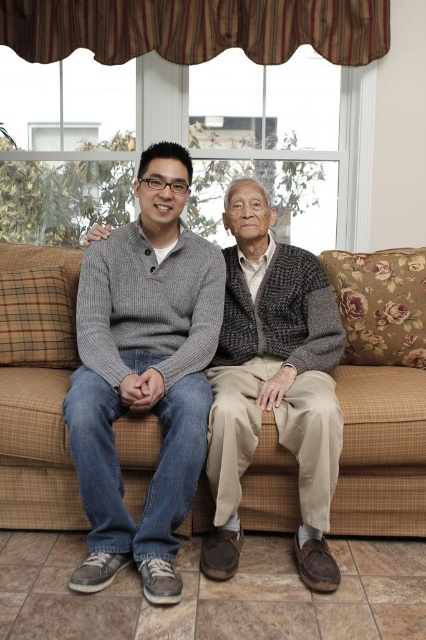
You are a delivery person who needs to place a small package on the brown plaid couch at center. However, there is a knit sweater at center in the way. Can you place the package on the couch without moving the sweater?

The brown plaid couch at center has a lesser height compared to knit sweater at center, so the couch is shorter than the sweater. Therefore, the package cannot be placed on the couch without moving the sweater because the sweater is taller and would block access to the surface.

You are standing in the living room and want to place a small plant between the two points, point (154, 387) and point (19, 483). Which point should the plant be closer to in order to be nearer to the viewer?

The plant should be closer to point (154, 387) because it is closer to the viewer than point (19, 483).

You are standing in the living room and want to place a small plant between the two points, point (11, 452) and point (321, 266). Which point should the plant be closer to so it is in front of the other point?

The plant should be closer to point (11, 452) because it is in front of point (321, 266).